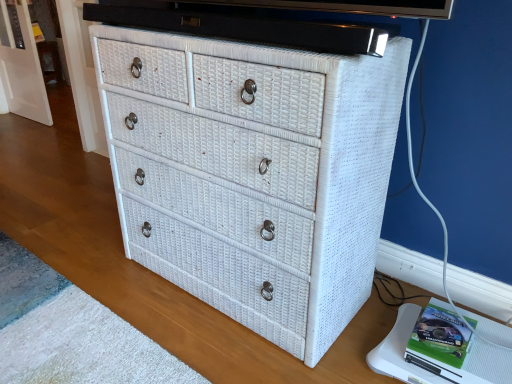
Find the location of `vacant space situated on the left part of white wicker chest of drawers at center`. vacant space situated on the left part of white wicker chest of drawers at center is located at coordinates (95, 254).